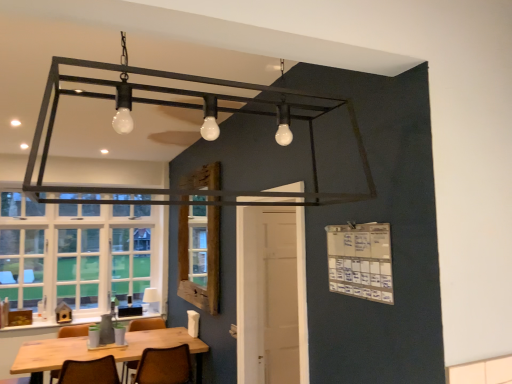
Question: Considering the positions of brown leather chair at lower center, which is counted as the first chair, starting from the right, and wooden frame at center in the image, is brown leather chair at lower center, which is counted as the first chair, starting from the right, wider or thinner than wooden frame at center?

Choices:
 (A) thin
 (B) wide

Answer: (B)

Question: From a real-world perspective, is brown leather chair at lower center, which is counted as the first chair, starting from the right, physically located above or below wooden frame at center?

Choices:
 (A) above
 (B) below

Answer: (B)

Question: Considering the real-world distances, which object is closest to the brown leather chair at lower left, the first chair positioned from the left?

Choices:
 (A) brown leather chair at lower center, the third chair viewed from the left
 (B) white fabric lampshade at lower center
 (C) wooden frame at center
 (D) brown leather chair at lower center, the second chair in the right-to-left sequence
 (E) wooden table at lower left

Answer: (E)

Question: Which object is positioned closest to the brown leather chair at lower center, the second chair in the right-to-left sequence?

Choices:
 (A) white glass window at left
 (B) wooden table at lower left
 (C) wooden frame at center
 (D) brown leather chair at lower center, which is counted as the first chair, starting from the right
 (E) white fabric lampshade at lower center

Answer: (E)